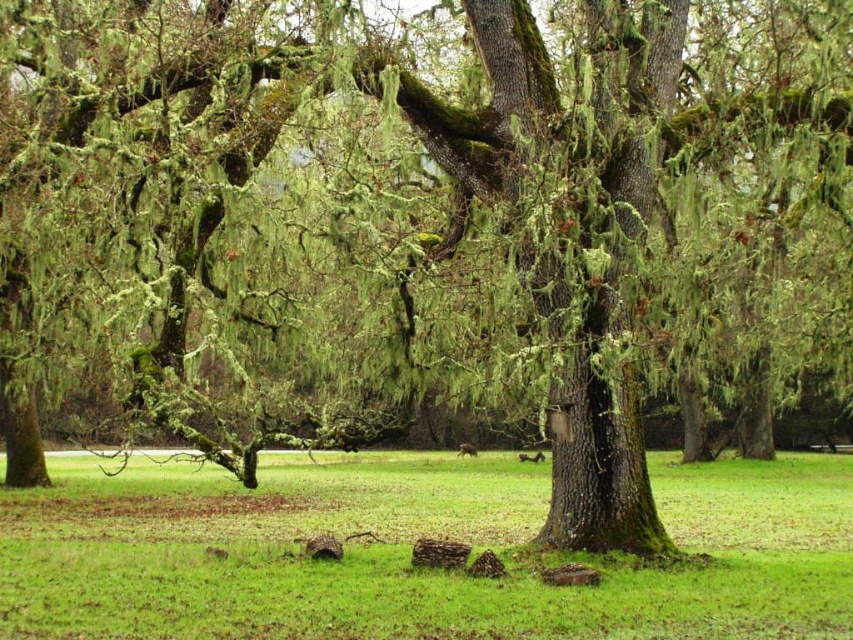
You are standing in the middle of the mossy forest scene. You see two points marked in the image. The first point is at coordinate point(350,614) and the second is at point(460,445). From your current position, which point is closer to you?

Point(350,614) is in front of point(460,445), so the first point is closer to you.

Looking at this image, you are a photographer wanting to capture the brown furry squirrel at center in the image. Since the green grass at center is in the way, can you determine if you can see the squirrel through the grass?

The green grass at center has a larger size compared to brown furry squirrel at center, so the grass may block the view of the squirrel.